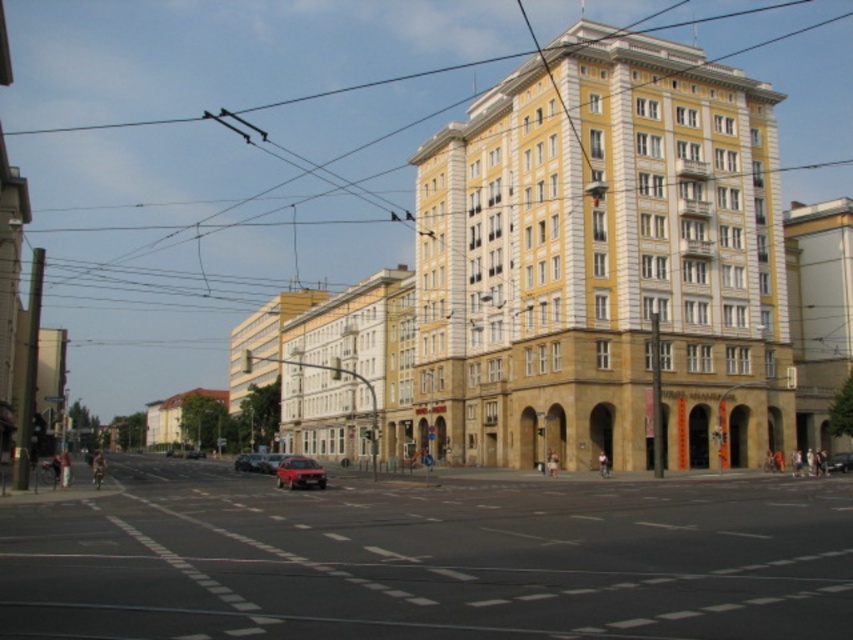
Question: Which point appears closest to the camera in this image?

Choices:
 (A) (303, 474)
 (B) (256, 470)

Answer: (A)

Question: In this image, where is matte red car at center located relative to red matte car at center?

Choices:
 (A) above
 (B) below

Answer: (B)

Question: Estimate the real-world distances between objects in this image. Which object is farther from the shiny red car at center?

Choices:
 (A) smooth asphalt road at center
 (B) red matte car at center

Answer: (B)

Question: Which point is closer to the camera taking this photo?

Choices:
 (A) (274, 456)
 (B) (126, 547)
 (C) (833, 460)
 (D) (259, 458)

Answer: (B)

Question: Can you confirm if smooth asphalt road at center is bigger than shiny red car at center?

Choices:
 (A) yes
 (B) no

Answer: (A)

Question: Does smooth asphalt road at center appear under shiny red car at center?

Choices:
 (A) no
 (B) yes

Answer: (A)